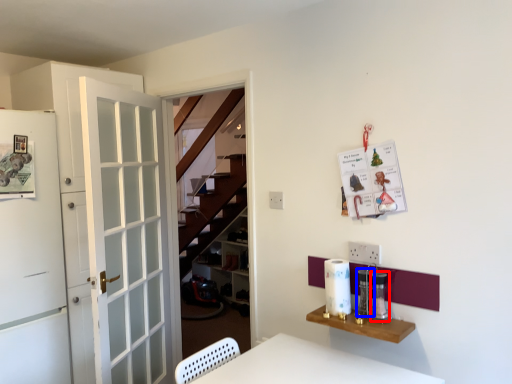
Question: Which object appears farthest to the camera in this image, appliance (highlighted by a red box) or appliance (highlighted by a blue box)?

Choices:
 (A) appliance
 (B) appliance

Answer: (B)